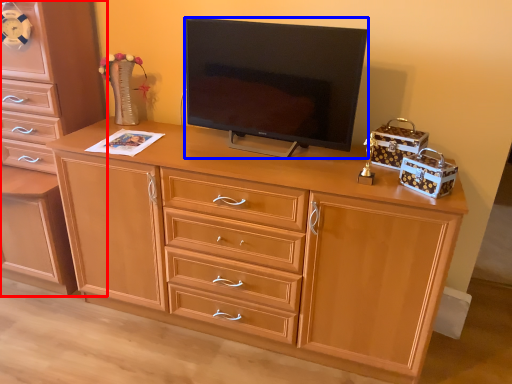
Question: Which object appears farthest to the camera in this image, chest of drawers (highlighted by a red box) or television (highlighted by a blue box)?

Choices:
 (A) chest of drawers
 (B) television

Answer: (A)